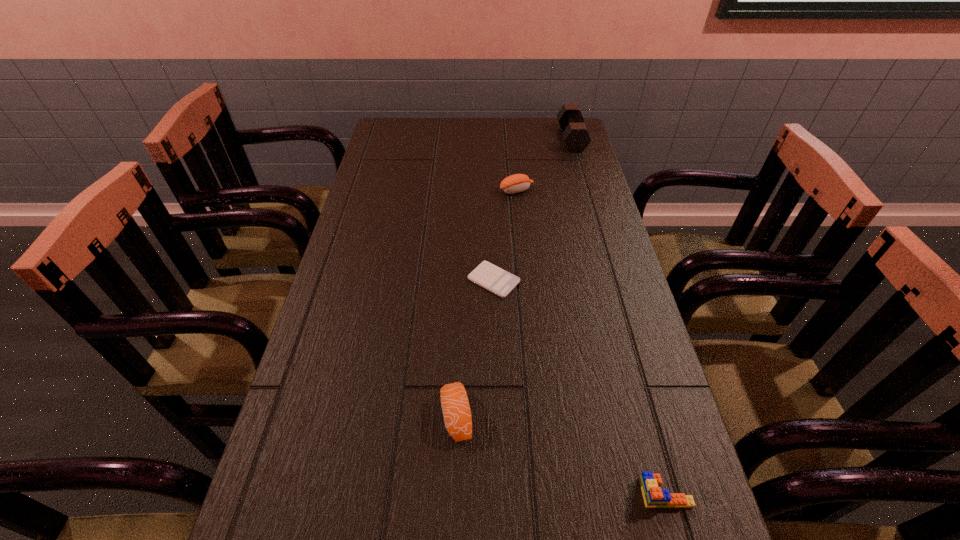
Image resolution: width=960 pixels, height=540 pixels. Identify the location of the farthest object. (575, 135).

You are a GUI agent. You are given a task and a screenshot of the screen. Output one action in this format:
    pyautogui.click(x=<x>, y=<y>)
    Task: Click on the dumbbell
    The width and height of the screenshot is (960, 540).
    Given the screenshot: What is the action you would take?
    pyautogui.click(x=575, y=135)

The image size is (960, 540). I want to click on the right sushi, so click(516, 183).

Identify the location of the fourth nearest object. The height and width of the screenshot is (540, 960). (516, 183).

Where is `Lego`? Lego is located at coordinates (654, 497).

Locate an element on the screen. The image size is (960, 540). the left sushi is located at coordinates (456, 410).

Find the location of a particular element. the nearer sushi is located at coordinates pos(456,410).

I want to click on the third nearest object, so click(500, 282).

Where is `calculator`? This screenshot has width=960, height=540. calculator is located at coordinates (500, 282).

Locate an element on the screen. The height and width of the screenshot is (540, 960). vacant space situated on the front of the farthest object is located at coordinates (593, 215).